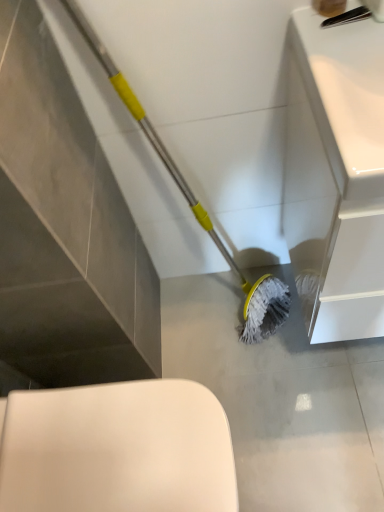
This screenshot has width=384, height=512. I want to click on vacant space situated above white glossy toilet at lower left (from a real-world perspective), so pos(93,445).